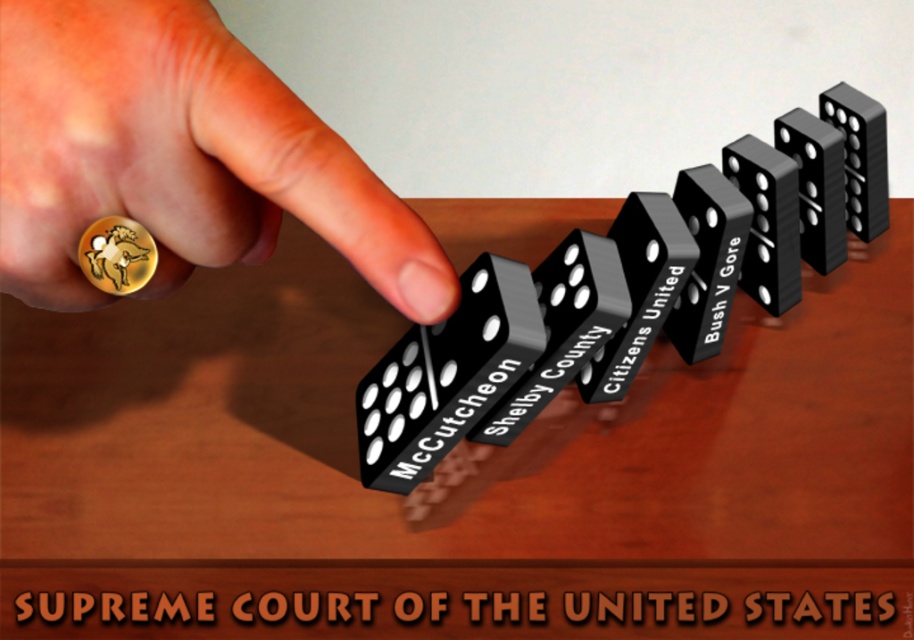
You are a game player who wants to set up dominoes in a straight line from left to right. You have the black plastic dominoes at center and the black plastic domino at upper right. Which domino should you place first to start the line?

The black plastic dominoes at center should be placed first because they are to the left of the black plastic domino at upper right, so starting with them ensures the line goes from left to right correctly.

You are setting up a game on the wooden table at center and need to place the black plastic domino at upper right. Considering the size difference, will the domino fit comfortably on the table?

The wooden table at center is larger in size than the black plastic domino at upper right, so the domino will fit comfortably on the table.

Looking at this image, you are standing 30 centimeters away from the wooden surface where the dominoes are placed. If you want to touch the point labeled as point (713, 164), can you reach it without moving your feet?

The point labeled point (713, 164) is 27.18 centimeters away from the viewer. Since you are standing 30 centimeters away from the wooden surface, you can reach it without moving your feet because the distance is within your reach.